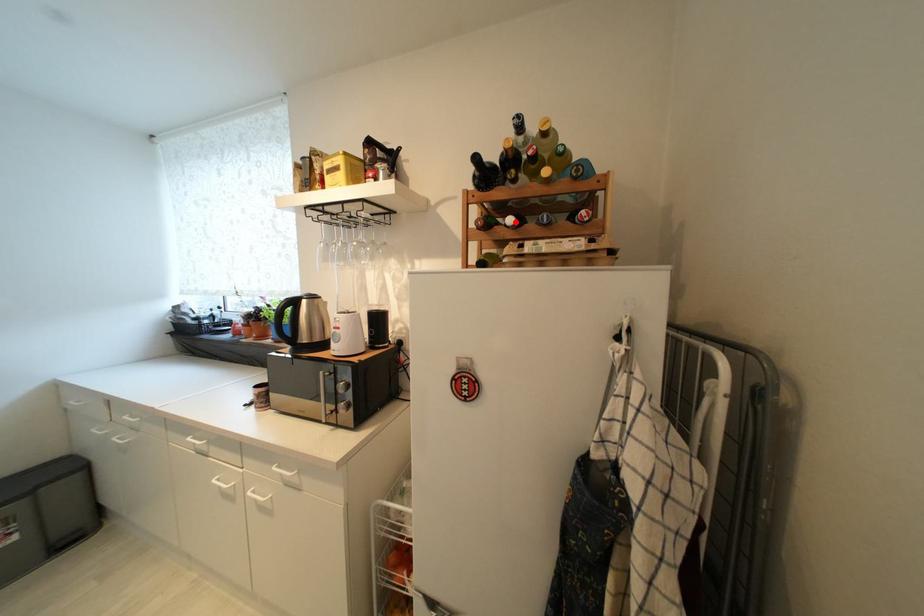
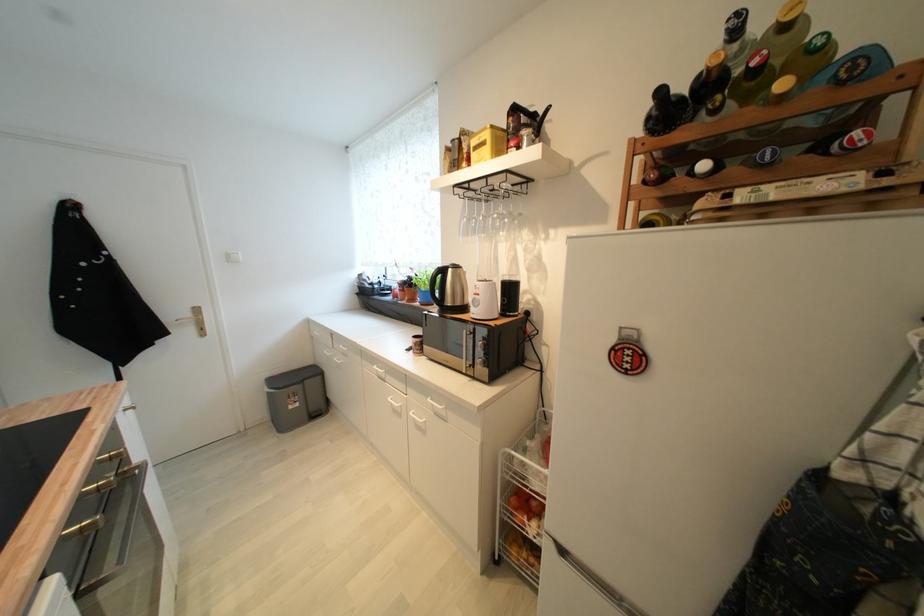
Find the pixel in the second image that matches the highlighted location in the first image.

(709, 168)